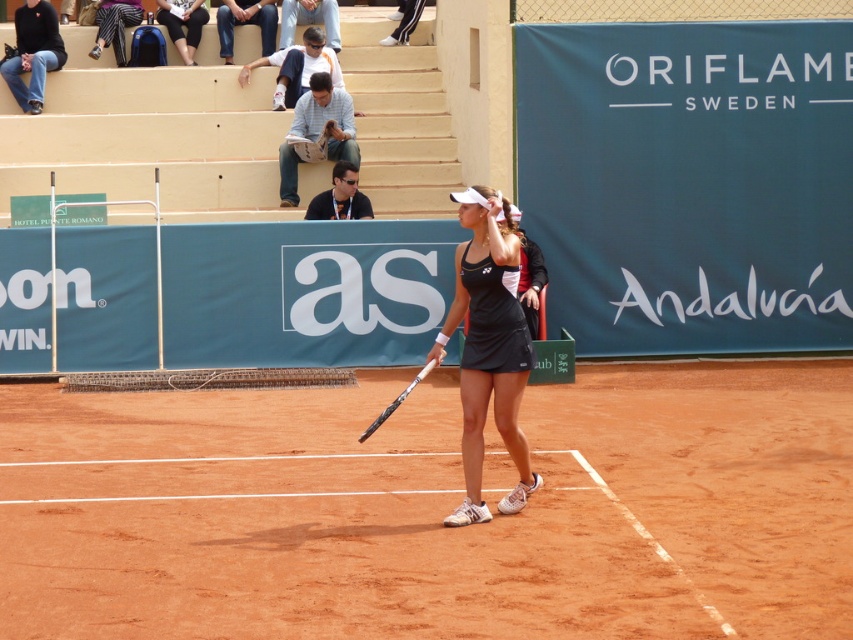
Question: Among these objects, which one is farthest from the camera?

Choices:
 (A) white glossy tennis racket at center
 (B) brown clay tennis court at center

Answer: (A)

Question: Which is nearer to the brown clay tennis court at center?

Choices:
 (A) black matte tennis skirt at center
 (B) white glossy tennis racket at center

Answer: (A)

Question: Observing the image, what is the correct spatial positioning of brown clay tennis court at center in reference to white glossy tennis racket at center?

Choices:
 (A) right
 (B) left

Answer: (A)

Question: Which of the following is the farthest from the observer?

Choices:
 (A) (421, 630)
 (B) (498, 387)
 (C) (410, 384)

Answer: (B)

Question: Is the position of brown clay tennis court at center more distant than that of white glossy tennis racket at center?

Choices:
 (A) yes
 (B) no

Answer: (B)

Question: Does brown clay tennis court at center have a larger size compared to black matte tennis skirt at center?

Choices:
 (A) no
 (B) yes

Answer: (B)